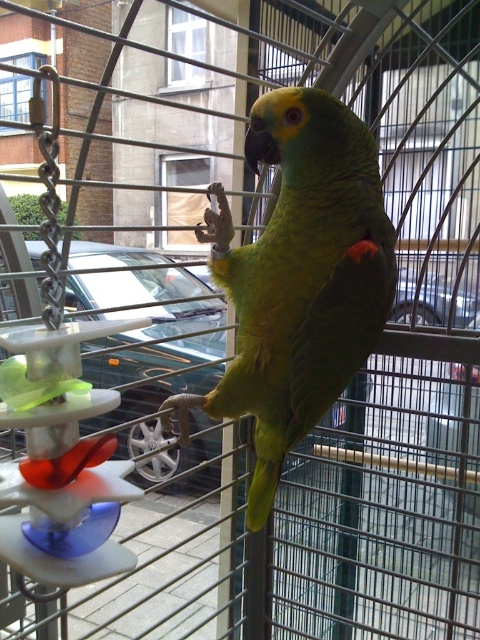
Question: Observing the image, what is the correct spatial positioning of green matte parrot at center in reference to metallic silver car at center?

Choices:
 (A) right
 (B) left

Answer: (A)

Question: Which point appears closest to the camera in this image?

Choices:
 (A) (284, 237)
 (B) (120, 381)

Answer: (A)

Question: Is green matte parrot at center smaller than metallic silver car at center?

Choices:
 (A) no
 (B) yes

Answer: (B)

Question: Is green matte parrot at center bigger than metallic silver car at center?

Choices:
 (A) no
 (B) yes

Answer: (A)